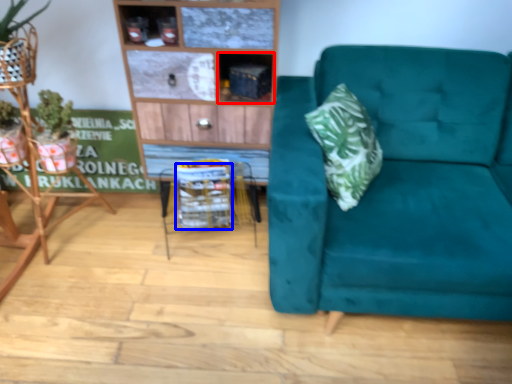
Question: Which of the following is the farthest to the observer, cabinet (highlighted by a red box) or basket (highlighted by a blue box)?

Choices:
 (A) cabinet
 (B) basket

Answer: (B)